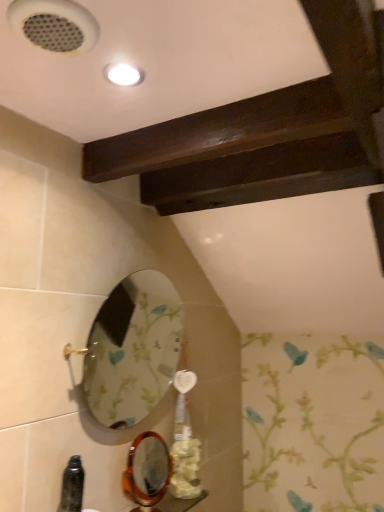
Question: Considering the relative positions of white matte flower at lower center and oval glass mirror at lower left in the image provided, is white matte flower at lower center to the left or to the right of oval glass mirror at lower left?

Choices:
 (A) right
 (B) left

Answer: (A)

Question: In terms of size, does white matte flower at lower center appear bigger or smaller than oval glass mirror at lower left?

Choices:
 (A) big
 (B) small

Answer: (B)

Question: From the image's perspective, is white matte flower at lower center positioned above or below oval glass mirror at lower left?

Choices:
 (A) above
 (B) below

Answer: (B)

Question: In terms of height, does oval glass mirror at lower left look taller or shorter compared to white matte flower at lower center?

Choices:
 (A) short
 (B) tall

Answer: (B)

Question: Would you say oval glass mirror at lower left is to the left or to the right of white matte flower at lower center in the picture?

Choices:
 (A) left
 (B) right

Answer: (A)

Question: Would you say oval glass mirror at lower left is inside or outside white matte flower at lower center?

Choices:
 (A) outside
 (B) inside

Answer: (A)

Question: In terms of width, does oval glass mirror at lower left look wider or thinner when compared to white matte flower at lower center?

Choices:
 (A) wide
 (B) thin

Answer: (A)